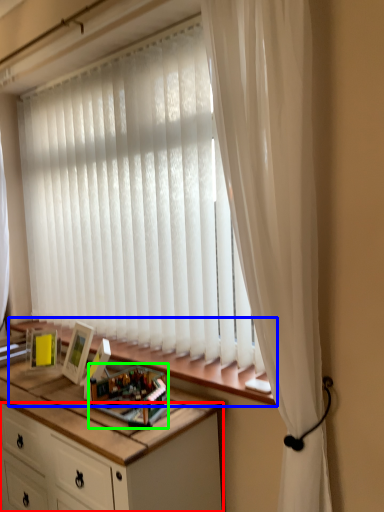
Question: Which is nearer to the cabinetry (highlighted by a red box)? window sill (highlighted by a blue box) or toy (highlighted by a green box).

Choices:
 (A) window sill
 (B) toy

Answer: (B)